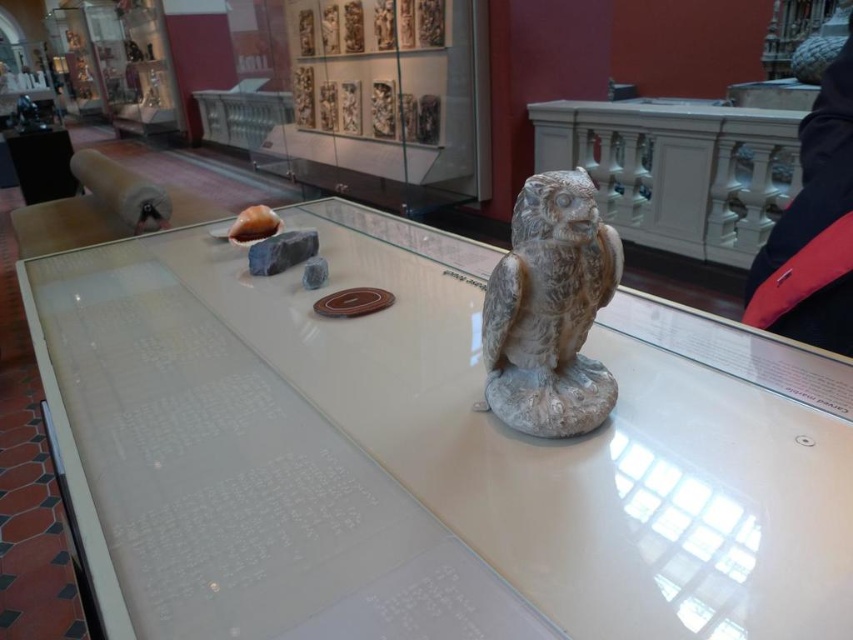
Which is behind, point (611, 557) or point (589, 404)?

Point (589, 404)

At what (x,y) coordinates should I click in order to perform the action: click on white glossy table at center. Please return your answer as a coordinate pair (x, y). This screenshot has width=853, height=640. Looking at the image, I should click on (427, 456).

Identify the location of white glossy table at center. This screenshot has height=640, width=853. (427, 456).